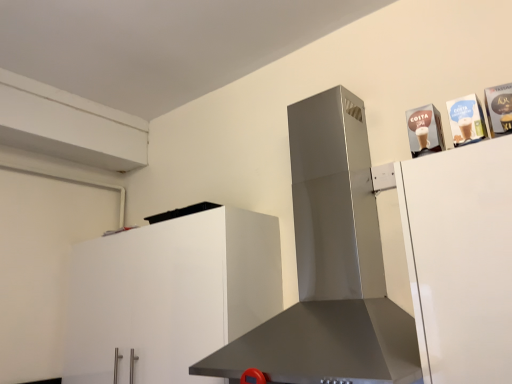
Question: Are satin silver range hood at center and white matte cabinet at lower left far apart?

Choices:
 (A) yes
 (B) no

Answer: (A)

Question: Considering the relative sizes of satin silver range hood at center and white matte cabinet at lower left in the image provided, is satin silver range hood at center smaller than white matte cabinet at lower left?

Choices:
 (A) yes
 (B) no

Answer: (B)

Question: From the image's perspective, is satin silver range hood at center located beneath white matte cabinet at lower left?

Choices:
 (A) yes
 (B) no

Answer: (B)

Question: Would you say satin silver range hood at center is outside white matte cabinet at lower left?

Choices:
 (A) no
 (B) yes

Answer: (B)

Question: Does satin silver range hood at center appear on the right side of white matte cabinet at lower left?

Choices:
 (A) no
 (B) yes

Answer: (B)

Question: Is satin silver range hood at center bigger than white matte cabinet at lower left?

Choices:
 (A) yes
 (B) no

Answer: (A)

Question: From the image's perspective, is white matte cabinet at lower left under satin silver range hood at center?

Choices:
 (A) no
 (B) yes

Answer: (B)

Question: Is white matte cabinet at lower left surrounding satin silver range hood at center?

Choices:
 (A) no
 (B) yes

Answer: (A)

Question: Considering the relative sizes of white matte cabinet at lower left and satin silver range hood at center in the image provided, is white matte cabinet at lower left smaller than satin silver range hood at center?

Choices:
 (A) yes
 (B) no

Answer: (A)

Question: From the image's perspective, would you say white matte cabinet at lower left is positioned over satin silver range hood at center?

Choices:
 (A) yes
 (B) no

Answer: (B)

Question: Can we say white matte cabinet at lower left lies outside satin silver range hood at center?

Choices:
 (A) yes
 (B) no

Answer: (A)

Question: Can you confirm if white matte cabinet at lower left is shorter than satin silver range hood at center?

Choices:
 (A) yes
 (B) no

Answer: (A)

Question: Is white matte cabinet at lower left to the left or to the right of satin silver range hood at center in the image?

Choices:
 (A) left
 (B) right

Answer: (A)